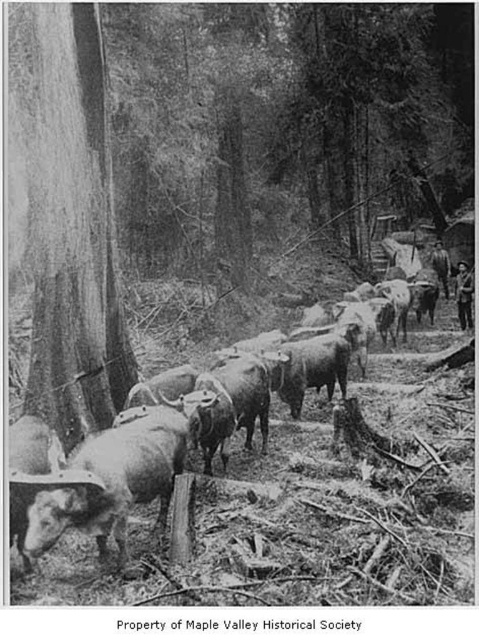
Question: Is smooth bark tree trunk at left wider than smooth gray cows at center?

Choices:
 (A) no
 (B) yes

Answer: (A)

Question: Which of the following is the closest to the observer?

Choices:
 (A) smooth gray cows at center
 (B) smooth bark tree trunk at left

Answer: (A)

Question: In this image, where is smooth bark tree trunk at left located relative to smooth gray cows at center?

Choices:
 (A) left
 (B) right

Answer: (A)

Question: Does smooth bark tree trunk at left have a smaller size compared to smooth gray cows at center?

Choices:
 (A) no
 (B) yes

Answer: (B)